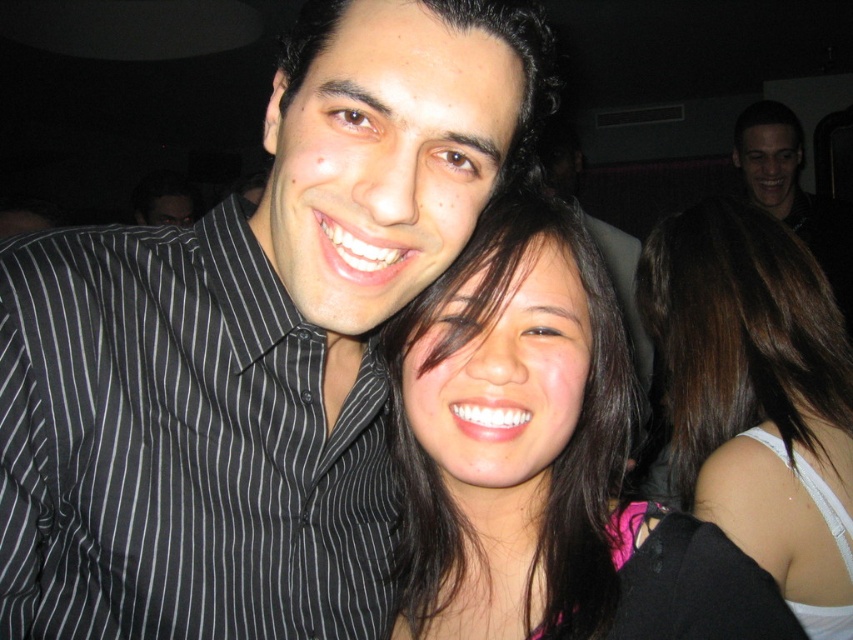
Question: Based on their relative distances, which object is nearer to the smooth dark hair at center?

Choices:
 (A) dark brown hair at center
 (B) black striped shirt at center

Answer: (B)

Question: Can you confirm if dark brown hair at center is positioned below black matte shirt at upper right?

Choices:
 (A) no
 (B) yes

Answer: (B)

Question: Which point is closer to the camera taking this photo?

Choices:
 (A) (305, 333)
 (B) (532, 520)

Answer: (A)

Question: Among these objects, which one is farthest from the camera?

Choices:
 (A) dark brown hair at center
 (B) black matte shirt at upper right
 (C) smooth dark hair at center

Answer: (B)

Question: In this image, where is dark brown hair at center located relative to black matte shirt at upper right?

Choices:
 (A) right
 (B) left

Answer: (B)

Question: Is black striped shirt at center thinner than dark brown hair at center?

Choices:
 (A) no
 (B) yes

Answer: (A)